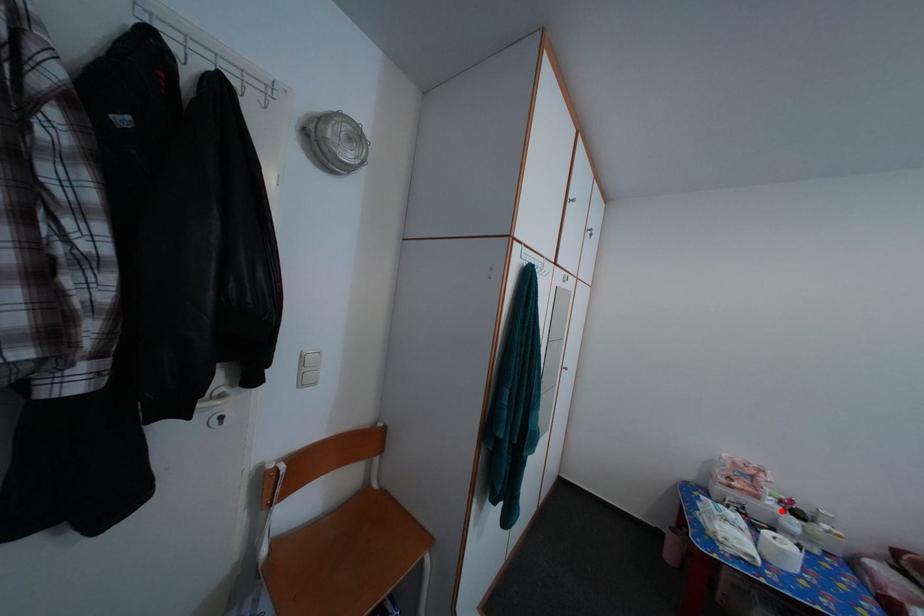
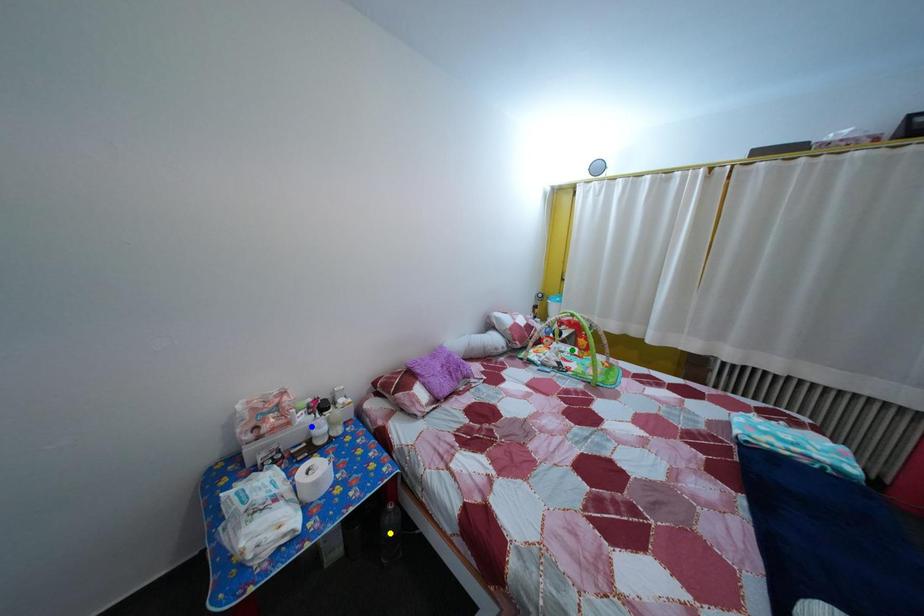
Question: I am providing you with two images of the same scene from different viewpoints. A red point is marked on the first image. You are given multiple points on the second image. Can you choose the point in image 2 that corresponds to the point in image 1?

Choices:
 (A) green point
 (B) yellow point
 (C) blue point

Answer: (C)